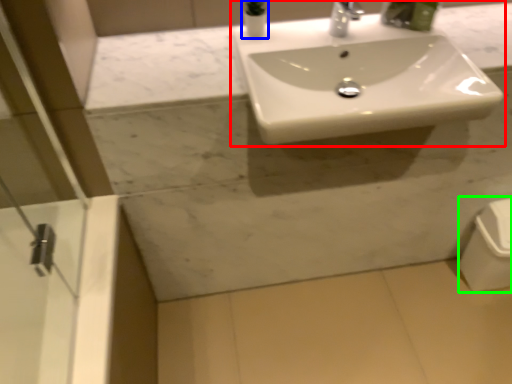
Question: Based on their relative distances, which object is farther from sink (highlighted by a red box)? Choose from toiletry (highlighted by a blue box) and porcelain (highlighted by a green box).

Choices:
 (A) toiletry
 (B) porcelain

Answer: (B)